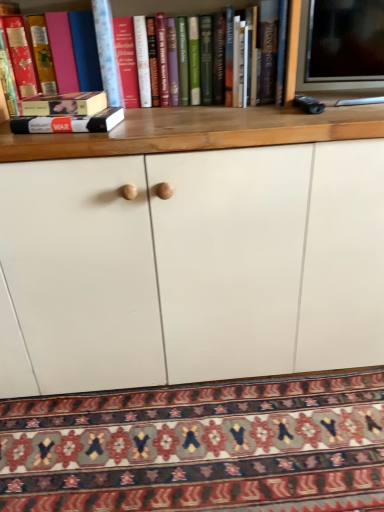
Question: Should I look upward or downward to see hardcover book at left, which appears as the second book when viewed from the top?

Choices:
 (A) up
 (B) down

Answer: (A)

Question: From the image's perspective, is patterned carpet at lower center located above hardcover book at left, marked as the first book in a bottom-to-top arrangement?

Choices:
 (A) no
 (B) yes

Answer: (A)

Question: Is hardcover book at left, which appears as the second book when viewed from the top, a part of patterned carpet at lower center?

Choices:
 (A) no
 (B) yes

Answer: (A)

Question: Is patterned carpet at lower center not inside hardcover book at left, marked as the first book in a bottom-to-top arrangement?

Choices:
 (A) no
 (B) yes

Answer: (B)

Question: Can you confirm if patterned carpet at lower center is positioned to the left of hardcover book at left, marked as the first book in a bottom-to-top arrangement?

Choices:
 (A) yes
 (B) no

Answer: (B)

Question: Does patterned carpet at lower center have a greater height compared to hardcover book at left, the first book viewed from the right?

Choices:
 (A) no
 (B) yes

Answer: (A)

Question: From a real-world perspective, is patterned carpet at lower center beneath hardcover book at left, the first book viewed from the right?

Choices:
 (A) no
 (B) yes

Answer: (B)

Question: Considering the relative sizes of matte pink book at left, arranged as the first book when viewed from the top, and patterned carpet at lower center in the image provided, is matte pink book at left, arranged as the first book when viewed from the top, smaller than patterned carpet at lower center?

Choices:
 (A) no
 (B) yes

Answer: (B)

Question: Can you confirm if matte pink book at left, which is counted as the 2th book, starting from the bottom, is taller than patterned carpet at lower center?

Choices:
 (A) no
 (B) yes

Answer: (B)

Question: Is matte pink book at left, which is counted as the 2th book, starting from the bottom, at the right side of patterned carpet at lower center?

Choices:
 (A) no
 (B) yes

Answer: (A)

Question: Would you say matte pink book at left, which is counted as the 2th book, starting from the bottom, is outside patterned carpet at lower center?

Choices:
 (A) yes
 (B) no

Answer: (A)

Question: From a real-world perspective, does matte pink book at left, which is the 2th book from right to left, sit lower than patterned carpet at lower center?

Choices:
 (A) no
 (B) yes

Answer: (A)

Question: Is matte pink book at left, which is the 2th book from right to left, placed right next to patterned carpet at lower center?

Choices:
 (A) no
 (B) yes

Answer: (A)

Question: From a real-world perspective, is patterned carpet at lower center under matte pink book at left, which is the 2th book from right to left?

Choices:
 (A) yes
 (B) no

Answer: (A)